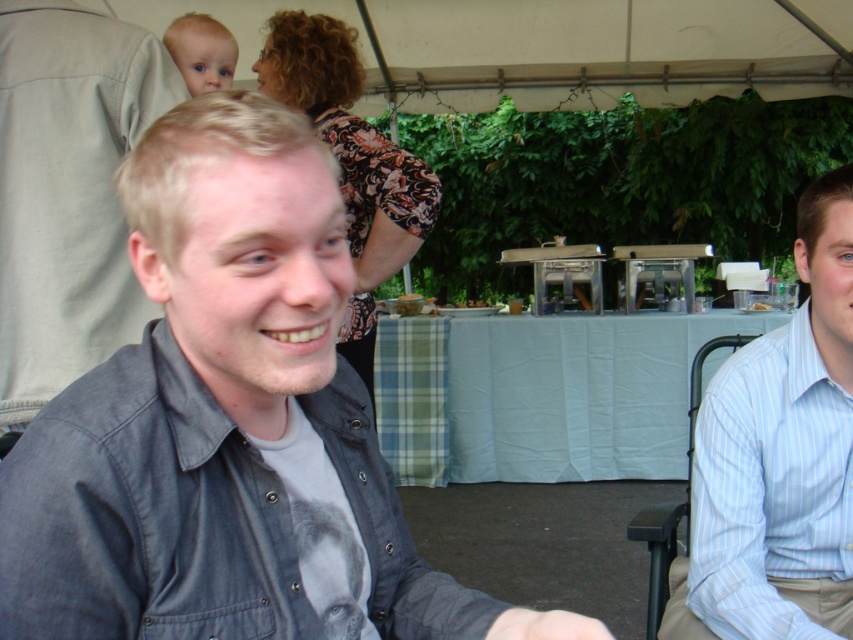
Question: Considering the real-world distances, which object is closest to the denim jacket at left?

Choices:
 (A) denim shirt at center
 (B) green plaid fabric at center
 (C) light blue striped shirt at right

Answer: (A)

Question: Is denim shirt at center bigger than light blue striped shirt at right?

Choices:
 (A) yes
 (B) no

Answer: (B)

Question: Can you confirm if denim shirt at center is positioned to the right of denim jacket at left?

Choices:
 (A) yes
 (B) no

Answer: (A)

Question: Which is nearer to the denim shirt at center?

Choices:
 (A) light blue striped shirt at right
 (B) denim jacket at left
 (C) green plaid fabric at center

Answer: (A)

Question: Estimate the real-world distances between objects in this image. Which object is farther from the light blue striped shirt at right?

Choices:
 (A) denim shirt at center
 (B) denim jacket at left
 (C) green plaid fabric at center

Answer: (C)

Question: Can you confirm if light blue striped shirt at right is bigger than denim jacket at left?

Choices:
 (A) yes
 (B) no

Answer: (A)